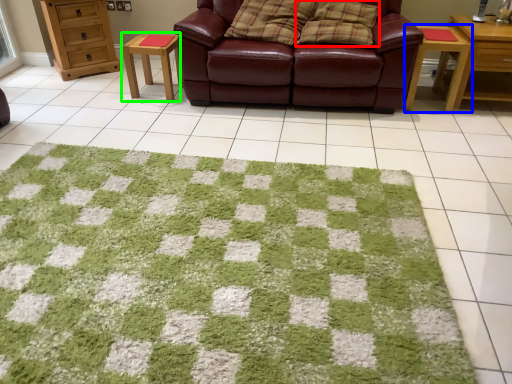
Question: Considering the real-world distances, which object is closest to pillow (highlighted by a red box)? table (highlighted by a blue box) or table (highlighted by a green box).

Choices:
 (A) table
 (B) table

Answer: (A)